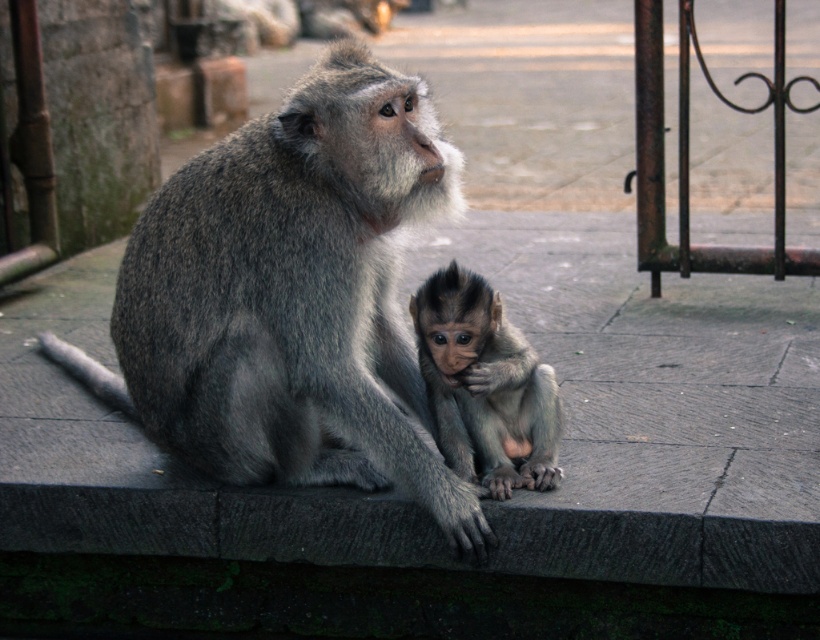
You are a photographer standing at the origin point of the coordinate system. You want to take a photo of the two points mentioned. Which point is closer to you, the photographer, between point (393, 212) and point (492, 291)?

Point (393, 212) is in front of point (492, 291), so it is closer to you, the photographer.

You are a wildlife photographer observing two monkeys on a stone ledge. You see the gray furry monkey at center and the soft gray fur monkey at center. Which monkey is taller?

The gray furry monkey at center is much taller than the soft gray fur monkey at center.

You are a wildlife photographer observing two monkeys on a stone ledge. You see the gray furry monkey at center and the soft gray fur monkey at center. Which monkey is located to the left of the other?

The gray furry monkey at center is positioned on the left side of the soft gray fur monkey at center.